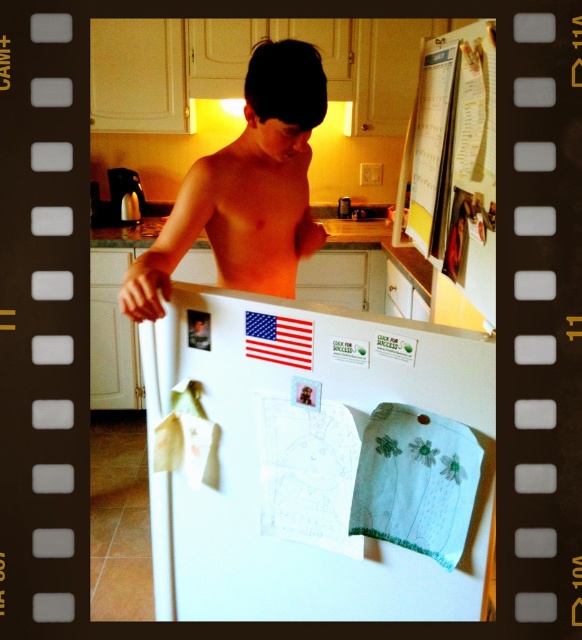
Question: Is shiny skin at center wider than pinkish flesh muscle at center?

Choices:
 (A) no
 (B) yes

Answer: (B)

Question: Estimate the real-world distances between objects in this image. Which object is closer to the white matte refrigerator at center?

Choices:
 (A) shiny skin at center
 (B) pinkish flesh muscle at center

Answer: (A)

Question: Is the position of white matte refrigerator at center more distant than that of shiny skin at center?

Choices:
 (A) no
 (B) yes

Answer: (A)

Question: Which point is farther to the camera?

Choices:
 (A) (271, 193)
 (B) (327, 376)

Answer: (A)

Question: Is white matte refrigerator at center behind shiny skin at center?

Choices:
 (A) yes
 (B) no

Answer: (B)

Question: Estimate the real-world distances between objects in this image. Which object is closer to the pinkish flesh muscle at center?

Choices:
 (A) white matte refrigerator at center
 (B) shiny skin at center

Answer: (B)